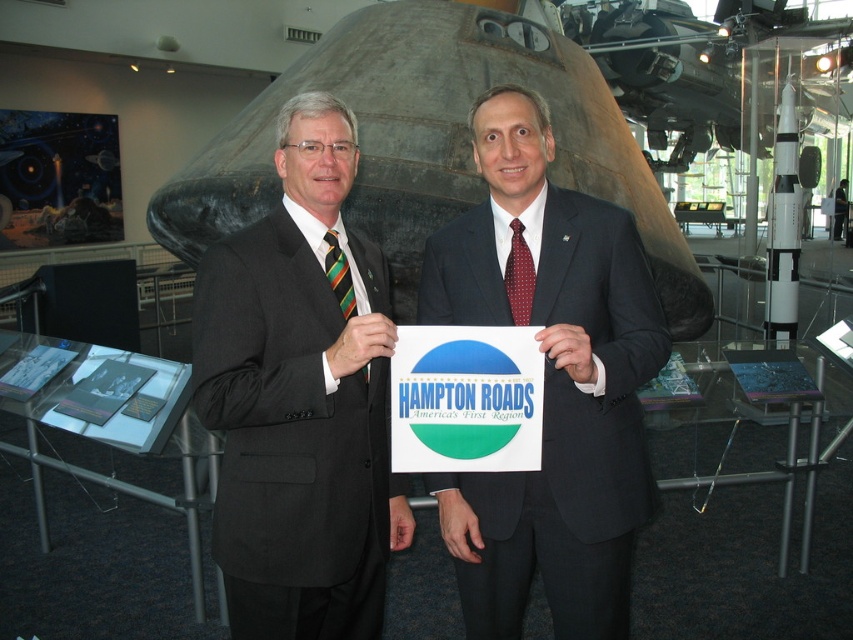
What do you see at coordinates (300, 397) in the screenshot? The image size is (853, 640). I see `black suit at center` at bounding box center [300, 397].

Which of these two, black suit at center or red dotted silk tie at center, stands shorter?

With less height is red dotted silk tie at center.

What are the coordinates of `black suit at center` in the screenshot? It's located at (300, 397).

Find the location of a particular element. The width and height of the screenshot is (853, 640). black suit at center is located at coordinates click(x=300, y=397).

Does black suit at center appear under shiny metallic rocket at center?

Yes.

Can you confirm if black suit at center is wider than shiny metallic rocket at center?

In fact, black suit at center might be narrower than shiny metallic rocket at center.

Is point (270, 573) in front of point (466, 189)?

Yes.

You are a GUI agent. You are given a task and a screenshot of the screen. Output one action in this format:
    pyautogui.click(x=<x>, y=<y>)
    Task: Click on the black suit at center
    
    Given the screenshot: What is the action you would take?
    pyautogui.click(x=300, y=397)

Which is above, dark gray suit at center or white glossy rocket at right?

white glossy rocket at right is above.

Looking at this image, is dark gray suit at center smaller than white glossy rocket at right?

Yes.

The width and height of the screenshot is (853, 640). I want to click on dark gray suit at center, so click(550, 387).